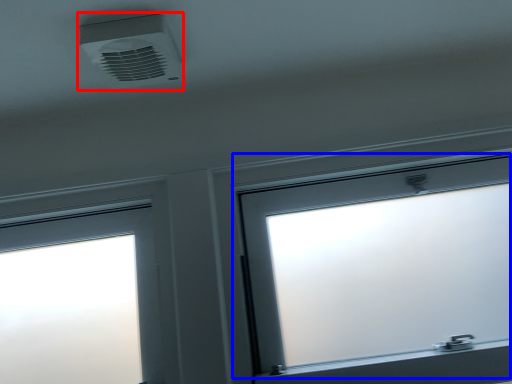
Question: Which of the following is the farthest to the observer, air conditioning (highlighted by a red box) or window (highlighted by a blue box)?

Choices:
 (A) air conditioning
 (B) window

Answer: (B)